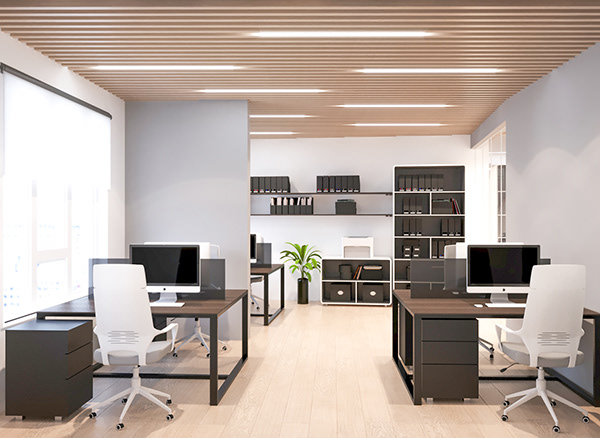
The width and height of the screenshot is (600, 438). Find the location of `storage shelf`. storage shelf is located at coordinates (386, 264), (452, 175).